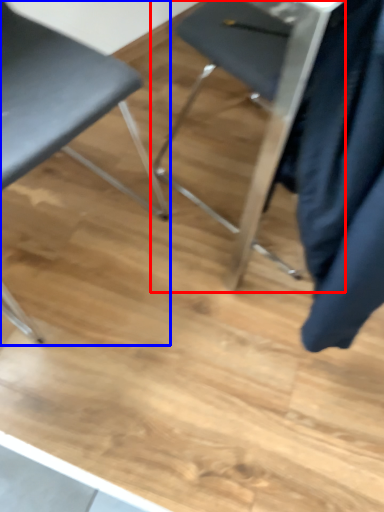
Question: Which object appears farthest to the camera in this image, chair (highlighted by a red box) or chair (highlighted by a blue box)?

Choices:
 (A) chair
 (B) chair

Answer: (A)